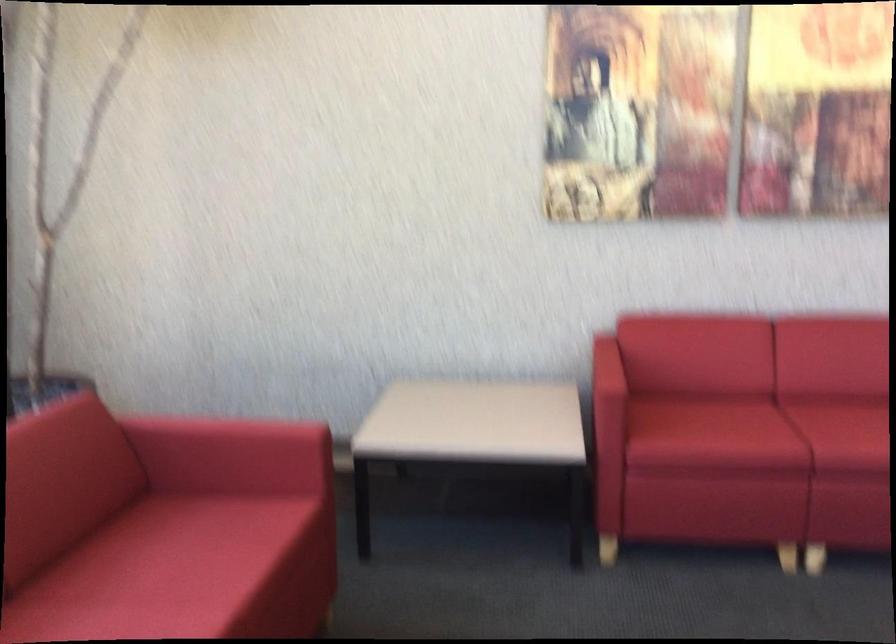
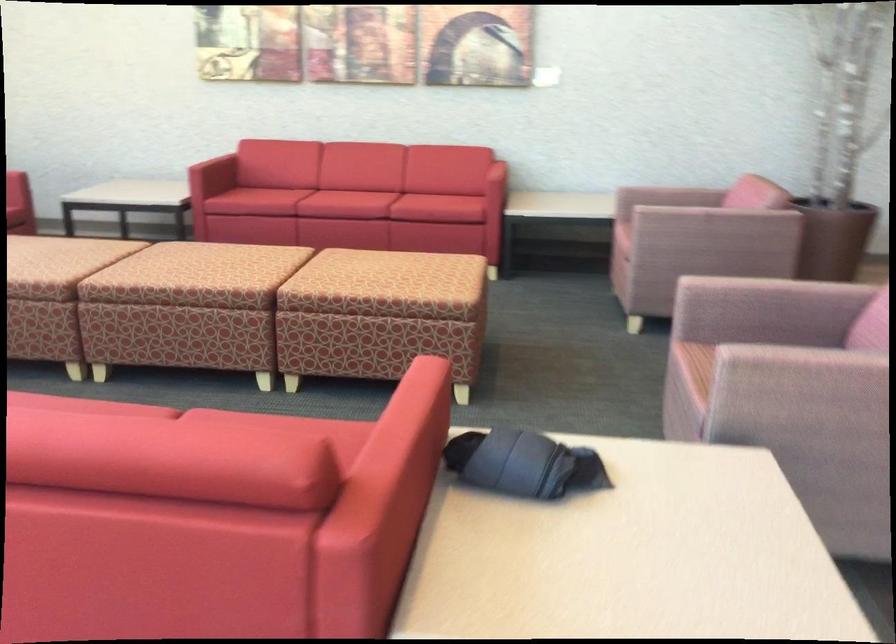
Question: I am providing you with two images of the same scene from different viewpoints. Please identify which objects are invisible in image2.

Choices:
 (A) pink chair sitting surface
 (B) red sofa armrest
 (C) pink chair armrest
 (D) plastic storage bin

Answer: (B)